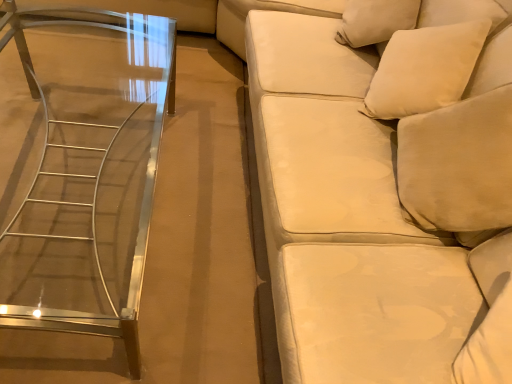
The height and width of the screenshot is (384, 512). What do you see at coordinates (385, 186) in the screenshot?
I see `velvet beige studio couch at right` at bounding box center [385, 186].

The width and height of the screenshot is (512, 384). Describe the element at coordinates (424, 69) in the screenshot. I see `white soft pillow at upper right` at that location.

At what (x,y) coordinates should I click in order to perform the action: click on clear glass table at left. Please return your answer as a coordinate pair (x, y). This screenshot has height=384, width=512. Looking at the image, I should click on (88, 175).

Image resolution: width=512 pixels, height=384 pixels. What are the coordinates of `velvet beige studio couch at right` in the screenshot? It's located at (385, 186).

Based on their positions, is white soft pillow at upper right located to the left or right of clear glass table at left?

Based on their positions, white soft pillow at upper right is located to the right of clear glass table at left.

Between point (464, 52) and point (114, 312), which one is positioned behind?

The point (114, 312) is farther from the camera.

Between white soft pillow at upper right and clear glass table at left, which one has larger size?

clear glass table at left is bigger.

In terms of width, does white soft pillow at upper right look wider or thinner when compared to clear glass table at left?

Clearly, white soft pillow at upper right has less width compared to clear glass table at left.

Considering their positions, is white soft pillow at upper right located in front of or behind velvet beige studio couch at right?

Clearly, white soft pillow at upper right is behind velvet beige studio couch at right.

Considering the relative sizes of white soft pillow at upper right and velvet beige studio couch at right in the image provided, is white soft pillow at upper right taller than velvet beige studio couch at right?

In fact, white soft pillow at upper right may be shorter than velvet beige studio couch at right.

From a real-world perspective, is white soft pillow at upper right physically located above or below velvet beige studio couch at right?

From a real-world perspective, white soft pillow at upper right is physically above velvet beige studio couch at right.

Where is `studio couch directly beneath the white soft pillow at upper right (from a real-world perspective)`? This screenshot has width=512, height=384. studio couch directly beneath the white soft pillow at upper right (from a real-world perspective) is located at coordinates (385, 186).

Is point (293, 319) closer or farther from the camera than point (86, 286)?

Clearly, point (293, 319) is closer to the camera than point (86, 286).

Between velvet beige studio couch at right and clear glass table at left, which one appears on the right side from the viewer's perspective?

velvet beige studio couch at right.

Which object is further away from the camera, velvet beige studio couch at right or clear glass table at left?

clear glass table at left is more distant.

How distant is velvet beige studio couch at right from clear glass table at left?

velvet beige studio couch at right is 28.66 inches away from clear glass table at left.

Is clear glass table at left facing away from velvet beige studio couch at right?

Correct, clear glass table at left is looking away from velvet beige studio couch at right.

Is point (116, 330) farther from camera compared to point (433, 356)?

That is True.

Can you confirm if clear glass table at left is shorter than velvet beige studio couch at right?

Indeed, clear glass table at left has a lesser height compared to velvet beige studio couch at right.

The width and height of the screenshot is (512, 384). I want to click on studio couch above the clear glass table at left (from a real-world perspective), so click(x=385, y=186).

How different are the orientations of velvet beige studio couch at right and white soft pillow at upper right in degrees?

velvet beige studio couch at right and white soft pillow at upper right are facing 1.24 degrees away from each other.

Looking at the image, does velvet beige studio couch at right seem bigger or smaller compared to white soft pillow at upper right?

Clearly, velvet beige studio couch at right is larger in size than white soft pillow at upper right.

Based on the photo, from a real-world perspective, which is physically below, velvet beige studio couch at right or white soft pillow at upper right?

velvet beige studio couch at right is physically lower.

Between velvet beige studio couch at right and white soft pillow at upper right, which one has smaller width?

white soft pillow at upper right.

Considering the relative sizes of clear glass table at left and white soft pillow at upper right in the image provided, is clear glass table at left smaller than white soft pillow at upper right?

No, clear glass table at left is not smaller than white soft pillow at upper right.

From a real-world perspective, does clear glass table at left sit lower than white soft pillow at upper right?

Yes, from a real-world perspective, clear glass table at left is under white soft pillow at upper right.

From the image's perspective, is clear glass table at left under white soft pillow at upper right?

Indeed, from the image's perspective, clear glass table at left is shown beneath white soft pillow at upper right.

How different are the orientations of clear glass table at left and white soft pillow at upper right in degrees?

3.09 degrees.

In order to click on table that appears in front of the white soft pillow at upper right in this screenshot , I will do `click(88, 175)`.

Locate an element on the screen. This screenshot has width=512, height=384. pillow on the right of velvet beige studio couch at right is located at coordinates (424, 69).

Based on their spatial positions, is clear glass table at left or white soft pillow at upper right closer to velvet beige studio couch at right?

white soft pillow at upper right is closer to velvet beige studio couch at right.

From the image, which object appears to be nearer to white soft pillow at upper right, clear glass table at left or velvet beige studio couch at right?

velvet beige studio couch at right is positioned closer to the anchor white soft pillow at upper right.

Estimate the real-world distances between objects in this image. Which object is closer to velvet beige studio couch at right, white soft pillow at upper right or clear glass table at left?

Among the two, white soft pillow at upper right is located nearer to velvet beige studio couch at right.

Looking at the image, which one is located closer to clear glass table at left, velvet beige studio couch at right or white soft pillow at upper right?

velvet beige studio couch at right lies closer to clear glass table at left than the other object.

From the image, which object appears to be nearer to white soft pillow at upper right, velvet beige studio couch at right or clear glass table at left?

velvet beige studio couch at right is positioned closer to the anchor white soft pillow at upper right.

When comparing their distances from clear glass table at left, does white soft pillow at upper right or velvet beige studio couch at right seem further?

white soft pillow at upper right is further to clear glass table at left.

The image size is (512, 384). What are the coordinates of `studio couch situated between clear glass table at left and white soft pillow at upper right from left to right` in the screenshot? It's located at (385, 186).